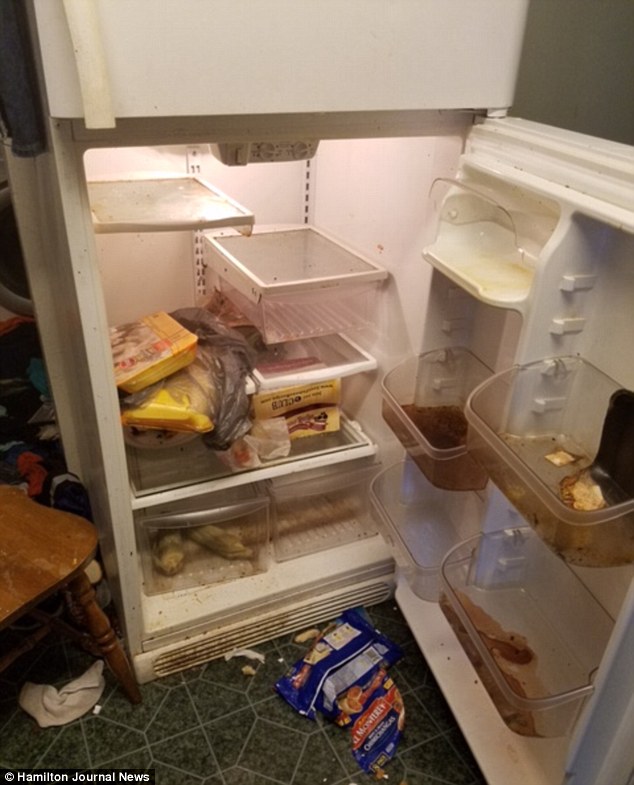
In order to click on rag in this screenshot , I will do `click(78, 696)`.